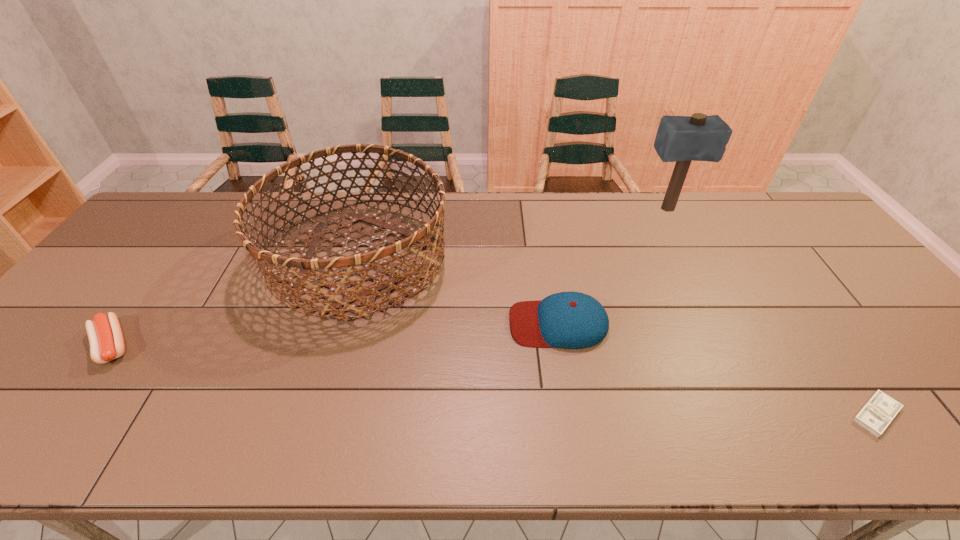
Locate an element on the screen. Image resolution: width=960 pixels, height=540 pixels. free space between the rightmost object and the basket is located at coordinates (618, 336).

Locate an element on the screen. This screenshot has width=960, height=540. free spot between the third shortest object and the second object from left to right is located at coordinates (459, 291).

The height and width of the screenshot is (540, 960). Identify the location of free space between the leftmost object and the shortest object. (494, 380).

Image resolution: width=960 pixels, height=540 pixels. Find the location of `empty space that is in between the sausage and the third shortest object`. empty space that is in between the sausage and the third shortest object is located at coordinates (335, 334).

Where is `free space between the nearest object and the leftmost object`? The height and width of the screenshot is (540, 960). free space between the nearest object and the leftmost object is located at coordinates (494, 380).

Locate an element on the screen. vacant area that lies between the second tallest object and the rightmost object is located at coordinates (618, 336).

At what (x,y) coordinates should I click in order to perform the action: click on object that is the closest to the basket. Please return your answer as a coordinate pair (x, y). The width and height of the screenshot is (960, 540). Looking at the image, I should click on (572, 320).

This screenshot has height=540, width=960. Identify the location of object that stands as the second closest to the leftmost object. (572, 320).

This screenshot has height=540, width=960. Find the location of `vacant area in the image that satisfies the following two spatial constraints: 1. on the back side of the mallet; 2. on the left side of the fourth object from right to left`. vacant area in the image that satisfies the following two spatial constraints: 1. on the back side of the mallet; 2. on the left side of the fourth object from right to left is located at coordinates (374, 209).

This screenshot has width=960, height=540. Identify the location of free space that satisfies the following two spatial constraints: 1. on the back side of the fourth tallest object; 2. on the left side of the basket. (177, 259).